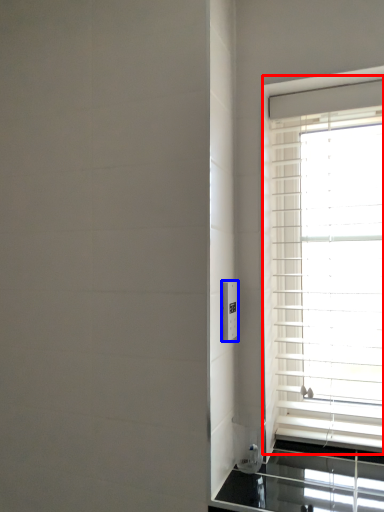
Question: Among these objects, which one is nearest to the camera, window (highlighted by a red box) or electric outlet (highlighted by a blue box)?

Choices:
 (A) window
 (B) electric outlet

Answer: (B)